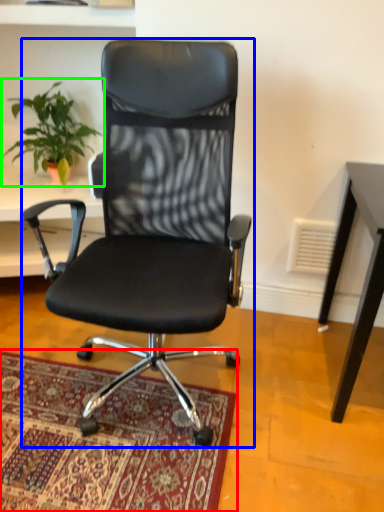
Question: Which object is positioned farthest from mat (highlighted by a red box)? Select from chair (highlighted by a blue box) and houseplant (highlighted by a green box).

Choices:
 (A) chair
 (B) houseplant

Answer: (B)